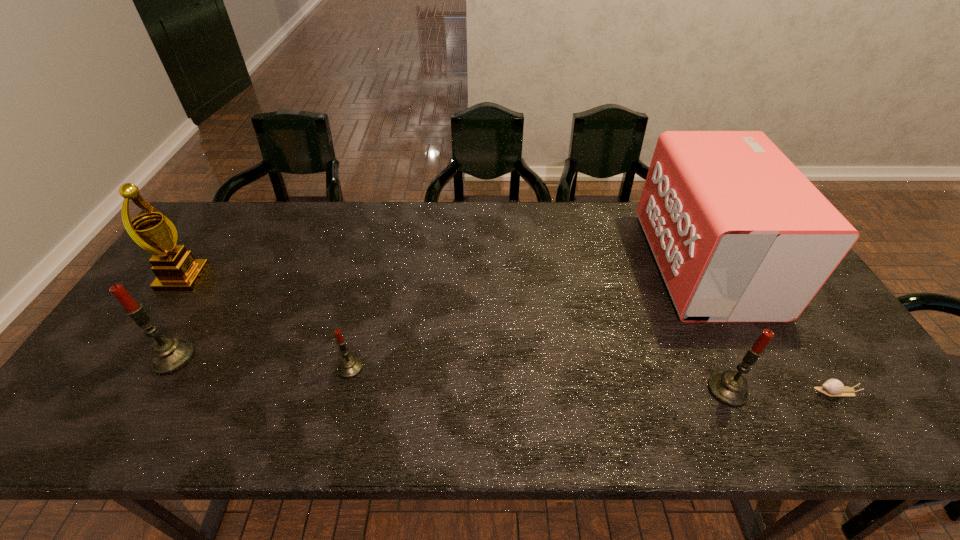
Identify the location of the leftmost candle. The height and width of the screenshot is (540, 960). (168, 354).

This screenshot has width=960, height=540. I want to click on the third object from left to right, so click(349, 367).

I want to click on the shortest candle, so click(x=349, y=367).

Where is `the fourth tallest object`? the fourth tallest object is located at coordinates (729, 388).

You are a GUI agent. You are given a task and a screenshot of the screen. Output one action in this format:
    pyautogui.click(x=<x>, y=<y>)
    Task: Click on the second shortest candle
    Image resolution: width=960 pixels, height=540 pixels.
    Given the screenshot: What is the action you would take?
    (x=729, y=388)

At what (x,y) coordinates should I click in order to perform the action: click on award. Please return your answer as a coordinate pair (x, y). Looking at the image, I should click on (176, 269).

This screenshot has width=960, height=540. In order to click on box in this screenshot , I will do [x=739, y=234].

Where is `escargot`? This screenshot has height=540, width=960. escargot is located at coordinates (832, 387).

This screenshot has width=960, height=540. Identify the location of vacant space situated on the left of the leftmost candle. (132, 358).

Locate an element on the screen. The image size is (960, 540). vacant space located 0.400m on the back of the fifth tallest object is located at coordinates (379, 252).